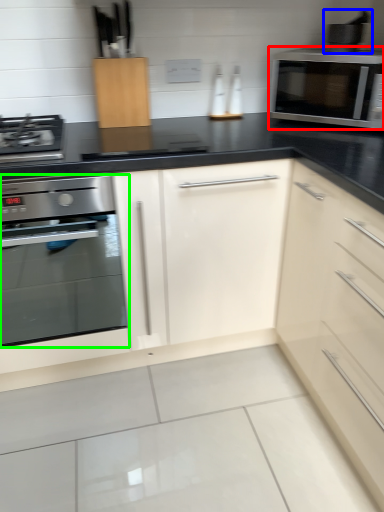
Question: Considering the real-world distances, which object is closest to microwave oven (highlighted by a red box)? appliance (highlighted by a blue box) or oven (highlighted by a green box).

Choices:
 (A) appliance
 (B) oven

Answer: (A)